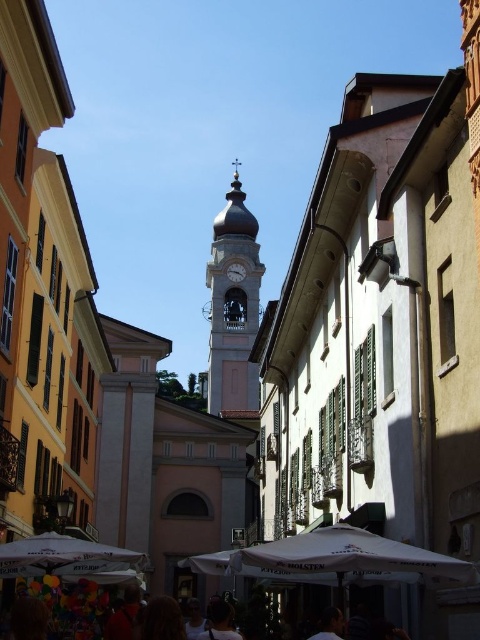
You are a tourist standing in the street scene and want to take a photo of the metallic gray clock at center and the dark brown hair at center. Which object should you focus on first if you want to capture both in one frame without moving the camera?

You should focus on the metallic gray clock at center first because the dark brown hair at center is to the right of it, so by centering the clock, the hair will naturally be in the frame to its right.

You are a tourist standing in the middle of the street looking at the scene. You notice a red shirt at lower center and a metallic gray clock at center. Which object is wider?

The metallic gray clock at center is wider than the red shirt at lower center because the red shirt at lower center has a smaller width.